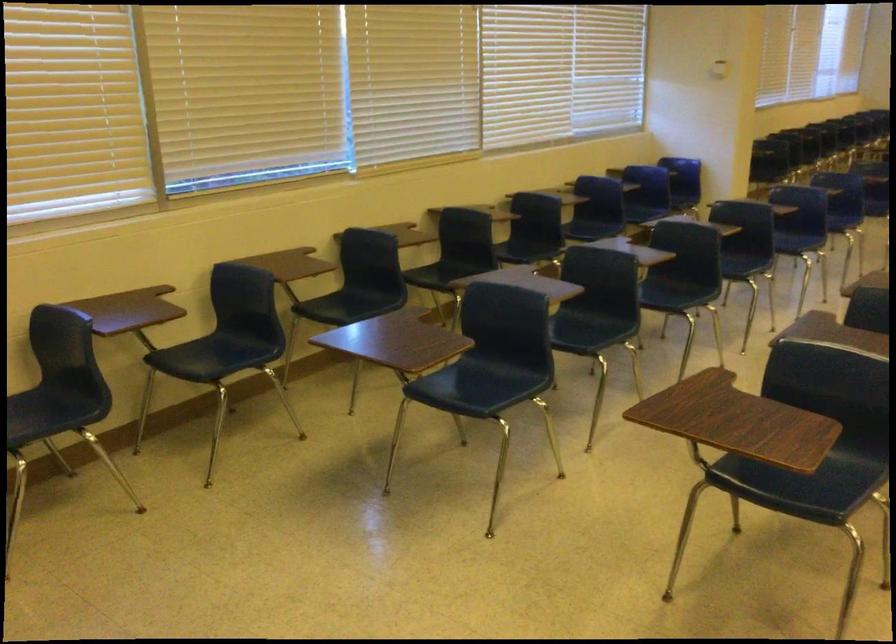
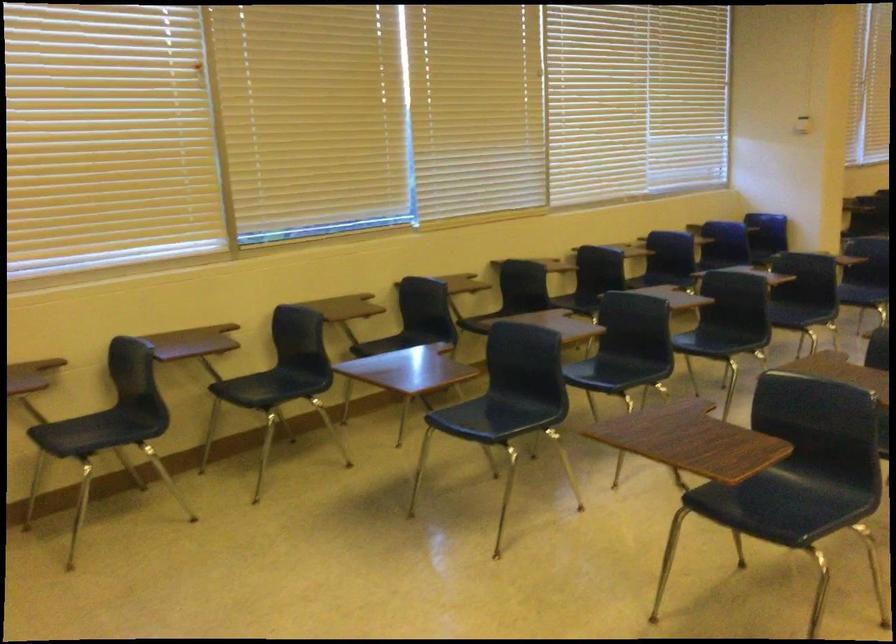
Question: How did the camera likely rotate?

Choices:
 (A) Left
 (B) Right
 (C) Up
 (D) Down

Answer: (A)